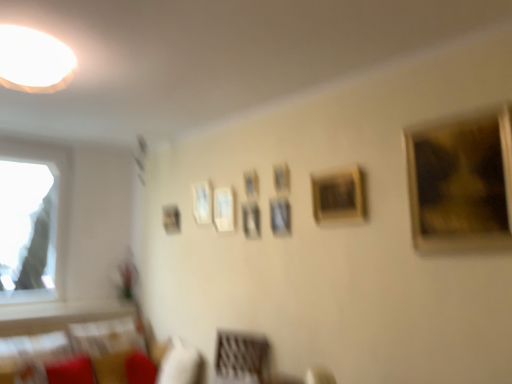
Question: Is gold textured painting at upper right, acting as the 1th picture frame starting from the front, completely or partially inside white glossy light at upper left?

Choices:
 (A) no
 (B) yes

Answer: (A)

Question: Could you tell me if white glossy light at upper left is facing gold textured painting at upper right, the 9th picture frame in the back-to-front sequence?

Choices:
 (A) no
 (B) yes

Answer: (A)

Question: Can you confirm if white glossy light at upper left is smaller than gold textured painting at upper right, the 1th picture frame positioned from the right?

Choices:
 (A) no
 (B) yes

Answer: (B)

Question: Is white glossy light at upper left oriented away from gold textured painting at upper right, arranged as the 9th picture frame when viewed from the left?

Choices:
 (A) no
 (B) yes

Answer: (A)

Question: Does white glossy light at upper left have a greater width compared to gold textured painting at upper right, acting as the 1th picture frame starting from the front?

Choices:
 (A) yes
 (B) no

Answer: (A)

Question: Is matte white frame at upper center, arranged as the 8th picture frame when viewed from the front, taller or shorter than wooden photo frame at center, the fourth picture frame in the left-to-right sequence?

Choices:
 (A) tall
 (B) short

Answer: (A)

Question: Considering their positions, is matte white frame at upper center, which appears as the second picture frame when viewed from the left, located in front of or behind wooden photo frame at center, the fourth picture frame in the left-to-right sequence?

Choices:
 (A) front
 (B) behind

Answer: (B)

Question: Is matte white frame at upper center, marked as the second picture frame in a back-to-front arrangement, wider or thinner than wooden photo frame at center, the fourth picture frame in the back-to-front sequence?

Choices:
 (A) thin
 (B) wide

Answer: (B)

Question: Considering the positions of point (202, 190) and point (256, 177), is point (202, 190) closer or farther from the camera than point (256, 177)?

Choices:
 (A) closer
 (B) farther

Answer: (B)

Question: Considering the positions of matte white picture frame at center, placed as the 3th picture frame when sorted from back to front, and matte black picture frame at upper center, which is the 9th picture frame from right to left, in the image, is matte white picture frame at center, placed as the 3th picture frame when sorted from back to front, wider or thinner than matte black picture frame at upper center, which is the 9th picture frame from right to left,?

Choices:
 (A) thin
 (B) wide

Answer: (B)

Question: From the image's perspective, is matte white picture frame at center, positioned as the 3th picture frame in left-to-right order, positioned above or below matte black picture frame at upper center, which is the 9th picture frame from right to left?

Choices:
 (A) below
 (B) above

Answer: (B)

Question: Looking at the image, does matte white picture frame at center, positioned as the 3th picture frame in left-to-right order, seem bigger or smaller compared to matte black picture frame at upper center, which appears as the 9th picture frame when viewed from the front?

Choices:
 (A) big
 (B) small

Answer: (A)

Question: From a real-world perspective, is matte white picture frame at center, placed as the 3th picture frame when sorted from back to front, above or below matte black picture frame at upper center, the 1th picture frame in the left-to-right sequence?

Choices:
 (A) below
 (B) above

Answer: (B)

Question: From a real-world perspective, is wooden frame at center, marked as the 2th picture frame in a right-to-left arrangement, physically located above or below wooden photo frame at center, which is the 6th picture frame in right-to-left order?

Choices:
 (A) above
 (B) below

Answer: (B)

Question: In terms of size, does wooden frame at center, which is counted as the eighth picture frame, starting from the left, appear bigger or smaller than wooden photo frame at center, which is counted as the 6th picture frame, starting from the front?

Choices:
 (A) big
 (B) small

Answer: (A)